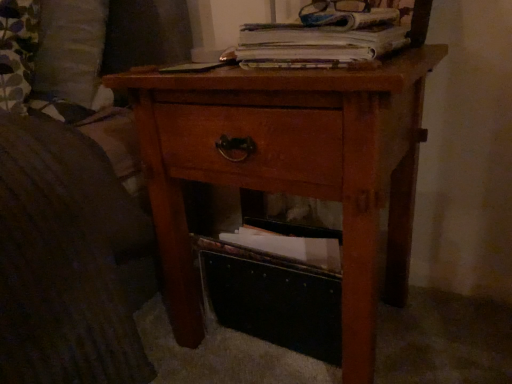
This screenshot has height=384, width=512. What are the coordinates of `wooden nightstand at center` in the screenshot? It's located at (290, 168).

What do you see at coordinates (315, 44) in the screenshot?
I see `white paper at upper center` at bounding box center [315, 44].

The height and width of the screenshot is (384, 512). I want to click on wooden nightstand at center, so click(x=290, y=168).

Based on the photo, which is more to the left, white paper at upper center or black fabric storage box at lower center?

black fabric storage box at lower center.

Is black fabric storage box at lower center surrounded by white paper at upper center?

No, black fabric storage box at lower center is located outside of white paper at upper center.

In the scene shown: Which is in front, white paper at upper center or black fabric storage box at lower center?

white paper at upper center is in front.

Is white paper at upper center surrounded by black fabric storage box at lower center?

Actually, white paper at upper center is outside black fabric storage box at lower center.

Can you see black fabric storage box at lower center touching white paper at upper center?

Answer: No, black fabric storage box at lower center is not touching white paper at upper center.

Is black fabric storage box at lower center looking in the opposite direction of white paper at upper center?

No, black fabric storage box at lower center is not facing the opposite direction of white paper at upper center.

Between point (270, 228) and point (293, 32), which one is positioned behind?

The point (270, 228) is behind.

From the image's perspective, which one is positioned lower, white paper at upper center or wooden nightstand at center?

From the image's view, wooden nightstand at center is below.

Which is in front, point (307, 47) or point (391, 295)?

The point (307, 47) is in front.

Is the surface of white paper at upper center in direct contact with wooden nightstand at center?

white paper at upper center and wooden nightstand at center are clearly separated.

In the scene shown: Between wooden nightstand at center and black fabric storage box at lower center, which one has smaller width?

black fabric storage box at lower center is thinner.

Considering the positions of objects wooden nightstand at center and black fabric storage box at lower center in the image provided, who is more to the right, wooden nightstand at center or black fabric storage box at lower center?

black fabric storage box at lower center is more to the right.

Which of these two, wooden nightstand at center or black fabric storage box at lower center, is bigger?

wooden nightstand at center is bigger.

Is wooden nightstand at center far from black fabric storage box at lower center?

wooden nightstand at center is near black fabric storage box at lower center, not far away.

Is wooden nightstand at center at the left side of white paper at upper center?

Yes.

From a real-world perspective, who is located higher, wooden nightstand at center or white paper at upper center?

white paper at upper center, from a real-world perspective.

Is wooden nightstand at center located outside white paper at upper center?

Yes.

Is wooden nightstand at center further to the viewer compared to white paper at upper center?

No, wooden nightstand at center is closer to the viewer.

In the scene shown: Can you confirm if black fabric storage box at lower center is smaller than wooden nightstand at center?

Indeed, black fabric storage box at lower center has a smaller size compared to wooden nightstand at center.

Is black fabric storage box at lower center further to camera compared to wooden nightstand at center?

Yes, black fabric storage box at lower center is further from the camera.

From a real-world perspective, which is physically above, black fabric storage box at lower center or wooden nightstand at center?

wooden nightstand at center, from a real-world perspective.

Is black fabric storage box at lower center inside the boundaries of wooden nightstand at center, or outside?

black fabric storage box at lower center is spatially positioned inside wooden nightstand at center.

The image size is (512, 384). Identify the location of paperback book lying in front of the black fabric storage box at lower center. (315, 44).

At what (x,y) coordinates should I click in order to perform the action: click on paperback book that appears on the right of black fabric storage box at lower center. Please return your answer as a coordinate pair (x, y). Looking at the image, I should click on (315, 44).

From the image, which object appears to be nearer to black fabric storage box at lower center, wooden nightstand at center or white paper at upper center?

Based on the image, wooden nightstand at center appears to be nearer to black fabric storage box at lower center.

Which object lies nearer to the anchor point wooden nightstand at center, white paper at upper center or black fabric storage box at lower center?

black fabric storage box at lower center is closer to wooden nightstand at center.

From the image, which object appears to be farther from black fabric storage box at lower center, white paper at upper center or wooden nightstand at center?

Based on the image, white paper at upper center appears to be further to black fabric storage box at lower center.

Which object lies nearer to the anchor point white paper at upper center, wooden nightstand at center or black fabric storage box at lower center?

Among the two, wooden nightstand at center is located nearer to white paper at upper center.

Considering their positions, is black fabric storage box at lower center positioned further to white paper at upper center than wooden nightstand at center?

black fabric storage box at lower center lies further to white paper at upper center than the other object.

From the image, which object appears to be nearer to wooden nightstand at center, black fabric storage box at lower center or white paper at upper center?

Among the two, black fabric storage box at lower center is located nearer to wooden nightstand at center.

This screenshot has height=384, width=512. Find the location of `nightstand between white paper at upper center and black fabric storage box at lower center vertically`. nightstand between white paper at upper center and black fabric storage box at lower center vertically is located at coordinates (290, 168).